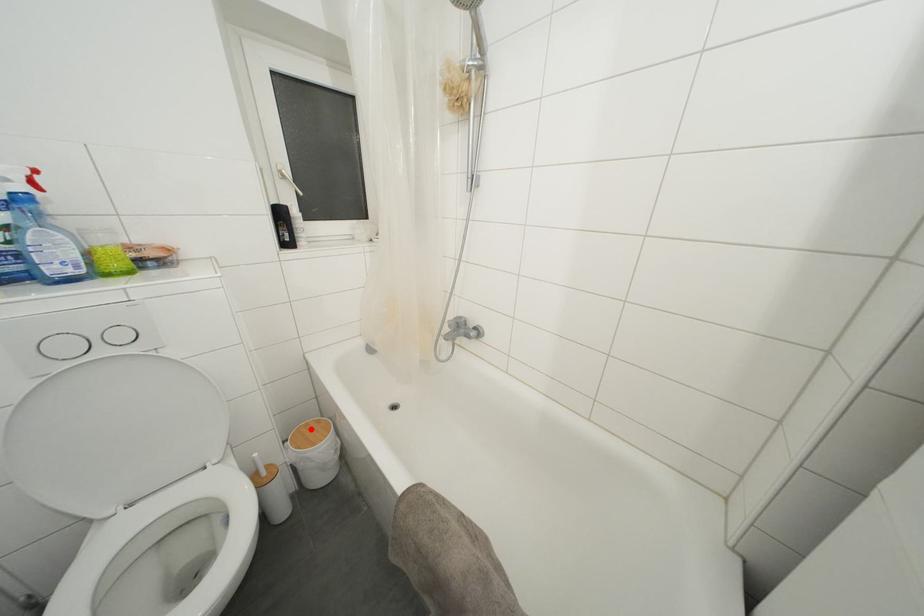
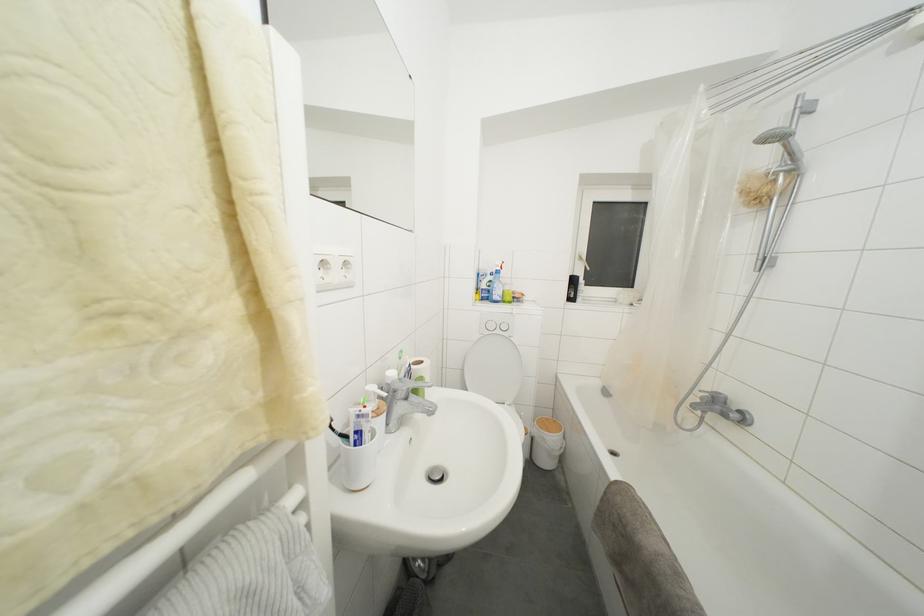
Question: I am providing you with two images of the same scene from different viewpoints. Image1 has a red point marked. In image2, the corresponding 3D location appears at what relative position? Reply with the corresponding letter.

Choices:
 (A) Closer
 (B) Farther

Answer: (A)